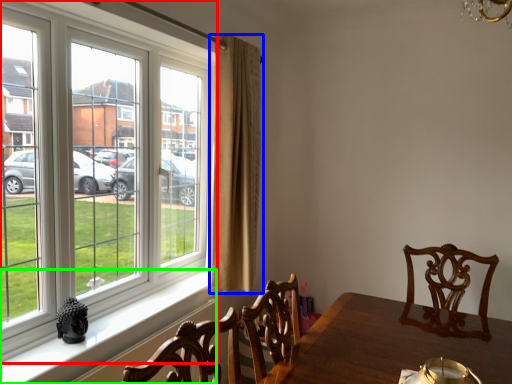
Question: Considering the real-world distances, which object is farthest from window (highlighted by a red box)? curtain (highlighted by a blue box) or window sill (highlighted by a green box)?

Choices:
 (A) curtain
 (B) window sill

Answer: (B)